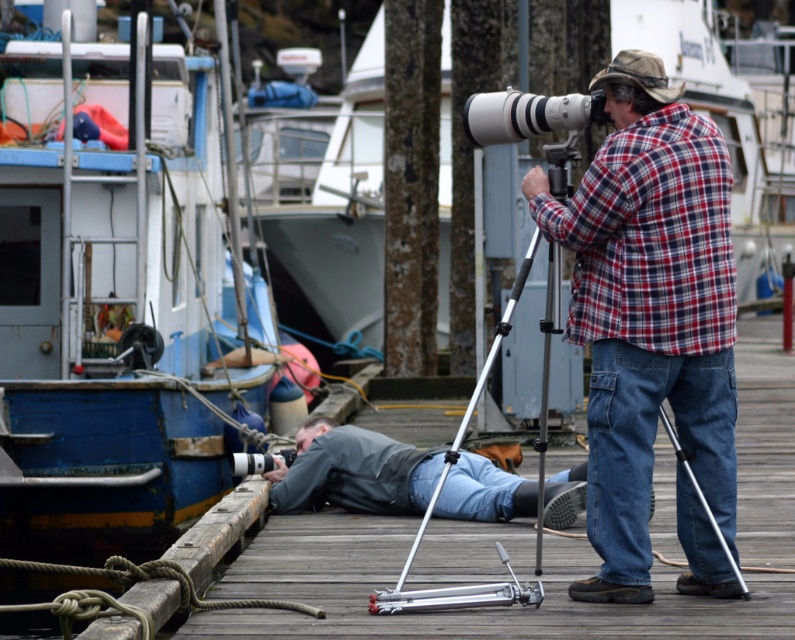
You are a photographer trying to capture a wide shot of the white glossy boat at upper center while using the silver metallic camera at center. Considering the distance between them, can you estimate if you can comfortably frame the boat in your shot without moving the camera?

The white glossy boat at upper center and silver metallic camera at center are 21.51 meters apart. At this distance, you should be able to comfortably frame the boat in your shot without moving the camera, as most cameras can adjust their zoom settings to capture subjects at such distances.

You are a photographer at the dock. You want to capture a closeup shot of the white glossy boat at upper center. You have a zoom lens that can magnify objects from a distance. However, you are currently positioned at the point marked by coordinates point (332, 200). Is this the best position to take the photo without moving closer?

The point (332, 200) marks the white glossy boat at upper center, so you are already at the location of the boat. To take a closeup shot, you don not need to move closer as you are already at the subject.

You are standing at the point marked as point [332,200] in the image. Looking around, you see a white glossy boat at upper center. Which direction should you face to look towards the white glossy boat at upper center?

Since the point [332,200] is on the white glossy boat at upper center, you are already facing towards the white glossy boat at upper center.